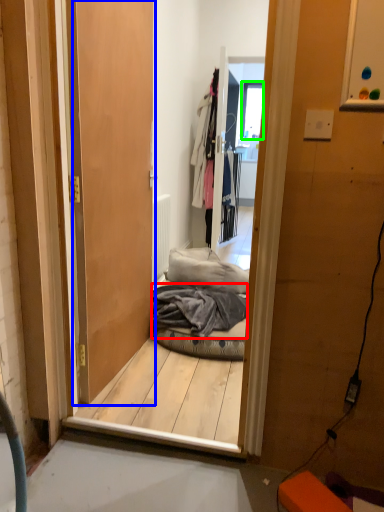
Question: Considering the real-world distances, which object is closest to material (highlighted by a red box)? door (highlighted by a blue box) or window (highlighted by a green box).

Choices:
 (A) door
 (B) window

Answer: (A)